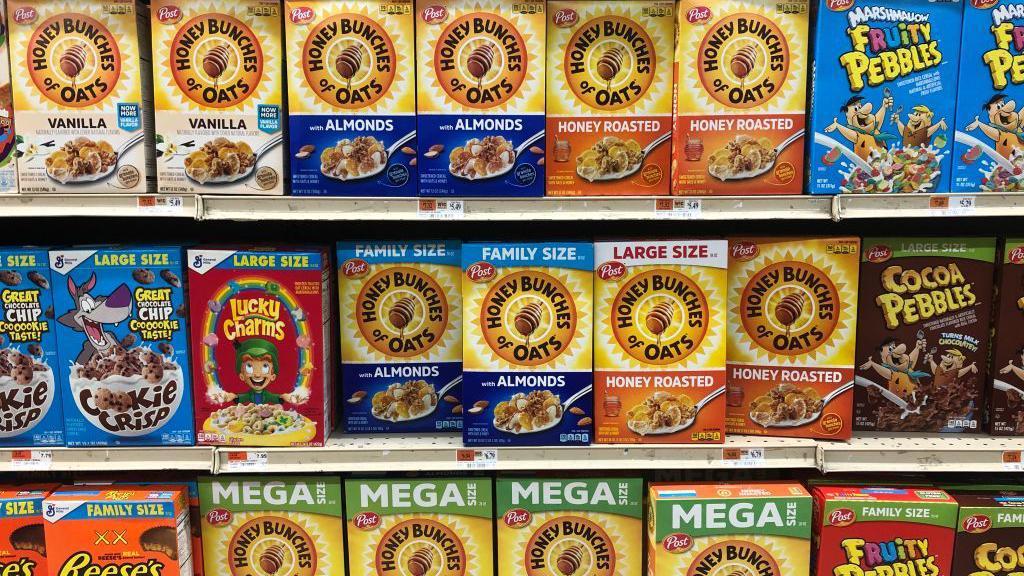
This screenshot has width=1024, height=576. I want to click on shelf section dividers, so click(x=198, y=206), click(x=213, y=454), click(x=835, y=203), click(x=818, y=453).